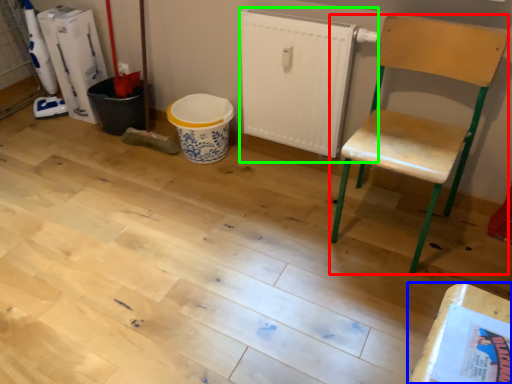
Question: Which object is the farthest from chair (highlighted by a red box)? Choose among these: table (highlighted by a blue box) or radiator (highlighted by a green box).

Choices:
 (A) table
 (B) radiator

Answer: (A)